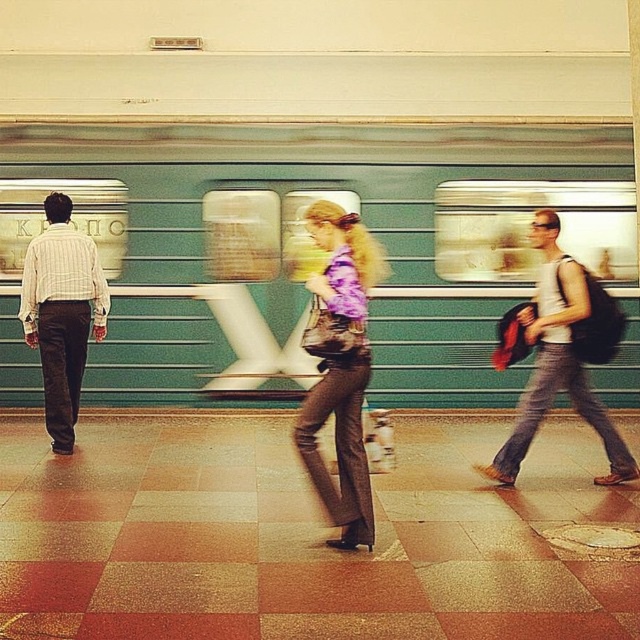
Question: Among these points, which one is nearest to the camera?

Choices:
 (A) (593, 410)
 (B) (321, 225)
 (C) (470, 152)
 (D) (104, 305)

Answer: (B)

Question: Is matte purple shirt at center below striped cotton shirt at left?

Choices:
 (A) yes
 (B) no

Answer: (A)

Question: Which object is positioned farthest from the matte purple shirt at center?

Choices:
 (A) teal glossy train at center
 (B) white tank top at right

Answer: (A)

Question: Observing the image, what is the correct spatial positioning of white tank top at right in reference to striped cotton shirt at left?

Choices:
 (A) left
 (B) right

Answer: (B)

Question: Is teal glossy train at center to the left of striped cotton shirt at left from the viewer's perspective?

Choices:
 (A) yes
 (B) no

Answer: (B)

Question: Among these points, which one is farthest from the camera?

Choices:
 (A) (620, 337)
 (B) (314, 480)
 (C) (484, 326)
 (D) (52, 321)

Answer: (C)